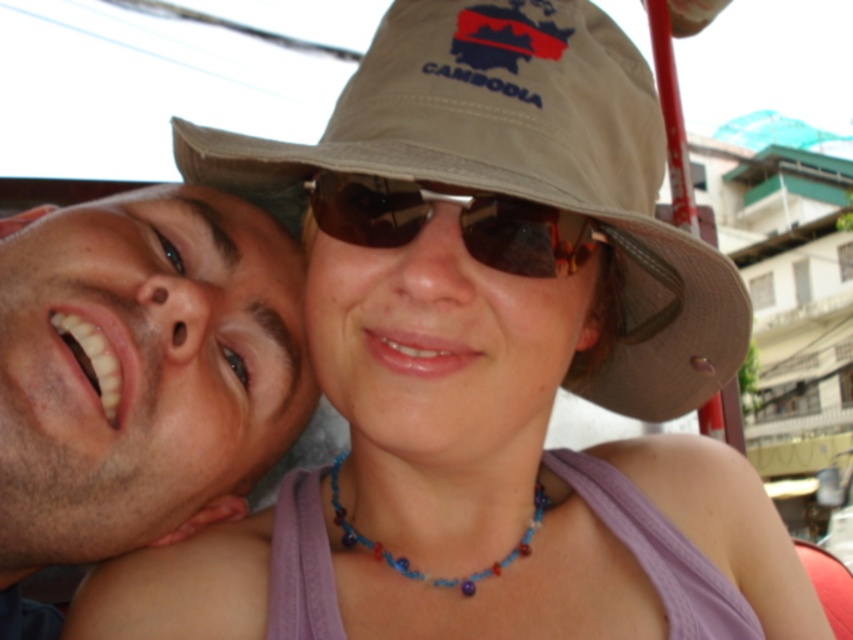
You are a photographer trying to capture a closeup of both the khaki fabric hat at center and the brown reflective sunglasses at center in the scene. Since they are very close to each other, will you need to adjust your camera focus to include both objects in the same frame?

The khaki fabric hat at center is positioned on the right side of brown reflective sunglasses at center, so they are close enough to be captured in the same frame without needing to adjust the focus.

You are a photographer trying to capture a clear shot of both the khaki fabric hat at center and the matte brown hat at center. Since you want to ensure both hats are visible in the frame, can you determine which direction you should position your camera relative to the subjects?

The khaki fabric hat at center is to the right of the matte brown hat at center. To ensure both are visible, position your camera so it faces the side where the khaki fabric hat at center is located, as it is positioned further to the right compared to the matte brown hat at center.